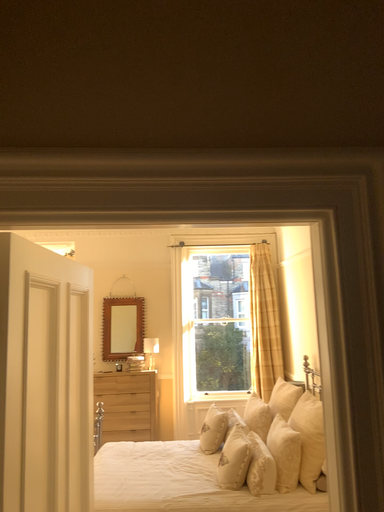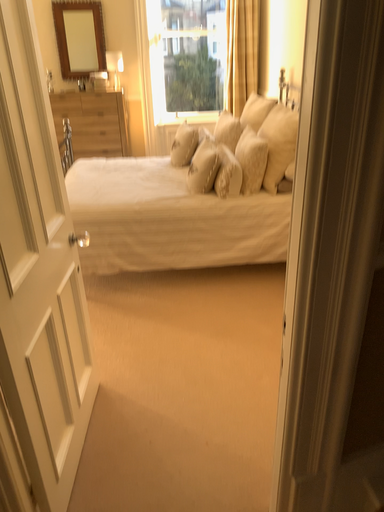
Question: How did the camera likely rotate when shooting the video?

Choices:
 (A) rotated downward
 (B) rotated upward

Answer: (A)